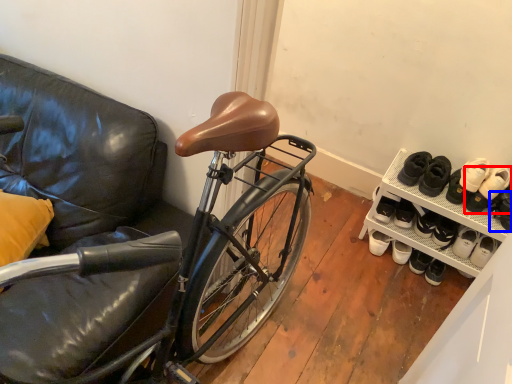
Question: Among these objects, which one is farthest to the camera, footwear (highlighted by a red box) or shoe (highlighted by a blue box)?

Choices:
 (A) footwear
 (B) shoe

Answer: (A)